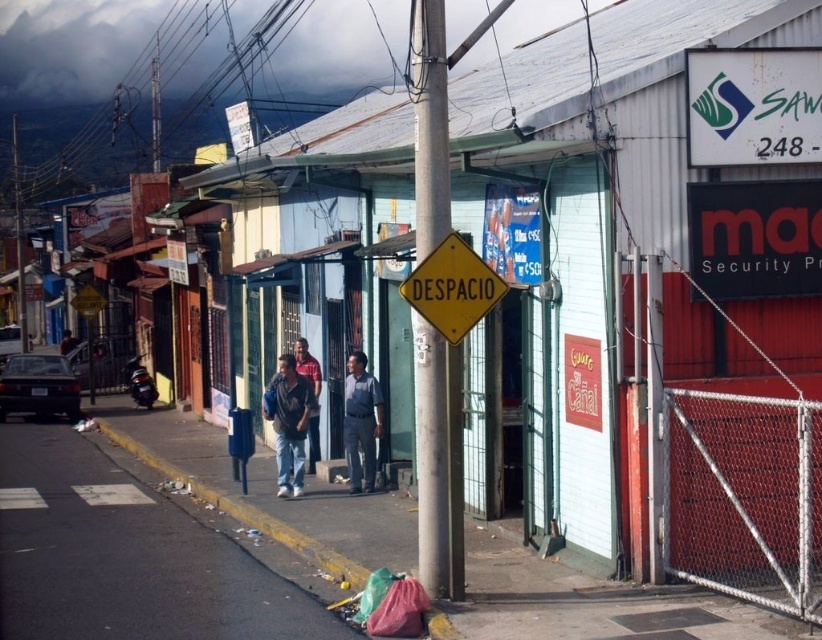
From the picture: Is dark blue uniform at center to the right of dark blue jeans at center from the viewer's perspective?

Correct, you'll find dark blue uniform at center to the right of dark blue jeans at center.

Who is more distant from viewer, [365,365] or [310,433]?

→ The point [310,433] is behind.

Find the location of a particular element. The image size is (822, 640). dark blue uniform at center is located at coordinates (361, 422).

Is gray asphalt pavement at lower center above metallic pole at center?

No, gray asphalt pavement at lower center is not above metallic pole at center.

Who is positioned more to the right, gray asphalt pavement at lower center or metallic pole at center?

metallic pole at center

Does point (93, 577) lie in front of point (428, 483)?

No, (93, 577) is further to viewer.

The width and height of the screenshot is (822, 640). What are the coordinates of `gray asphalt pavement at lower center` in the screenshot? It's located at (125, 556).

Who is more distant from viewer, (427,397) or (755,108)?

The point (755,108) is behind.

Which is above, metallic pole at center or white plastic sign at upper right?

white plastic sign at upper right is above.

Between point (418, 342) and point (728, 124), which one is positioned behind?

The point (728, 124) is behind.

Locate an element on the screen. This screenshot has height=640, width=822. metallic pole at center is located at coordinates (437, 461).